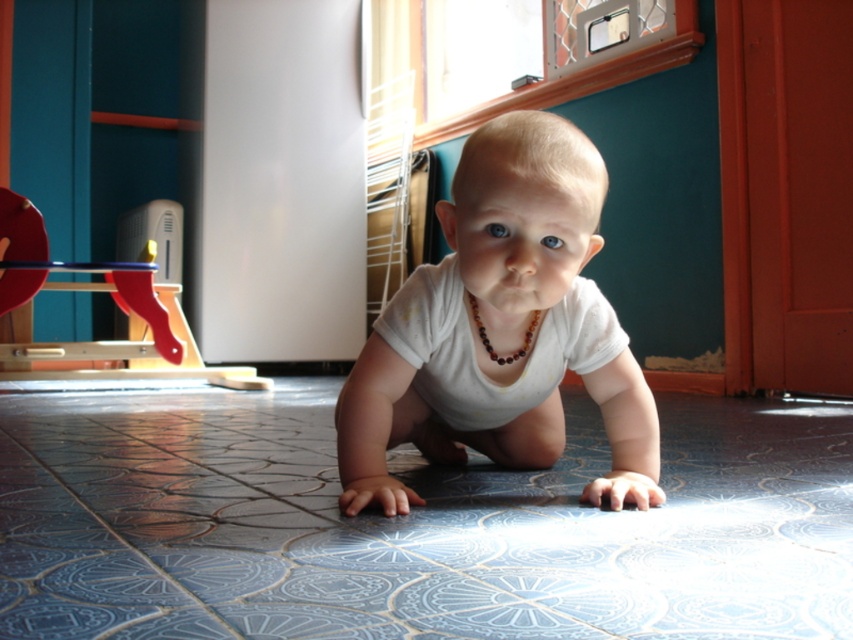
Question: Considering the real-world distances, which object is farthest from the blue textured tile at center?

Choices:
 (A) wooden toy at left
 (B) white matte onesie at center

Answer: (A)

Question: Which object is the closest to the blue textured tile at center?

Choices:
 (A) wooden toy at left
 (B) white matte onesie at center

Answer: (B)

Question: Can you confirm if white matte onesie at center is wider than wooden toy at left?

Choices:
 (A) yes
 (B) no

Answer: (B)

Question: Does blue textured tile at center have a greater width compared to white matte onesie at center?

Choices:
 (A) yes
 (B) no

Answer: (A)

Question: Considering the real-world distances, which object is closest to the white matte onesie at center?

Choices:
 (A) blue textured tile at center
 (B) wooden toy at left

Answer: (A)

Question: In this image, where is blue textured tile at center located relative to white matte onesie at center?

Choices:
 (A) below
 (B) above

Answer: (A)